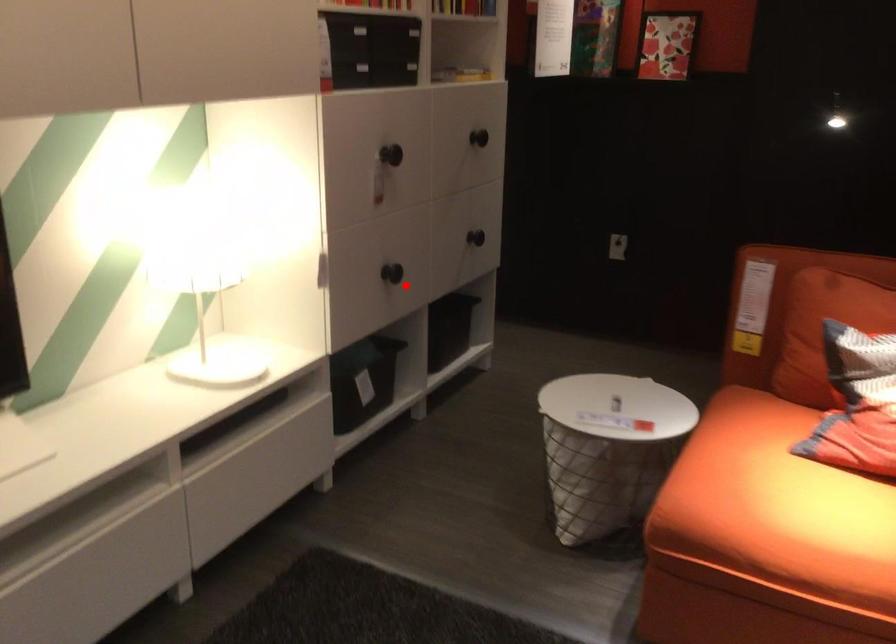
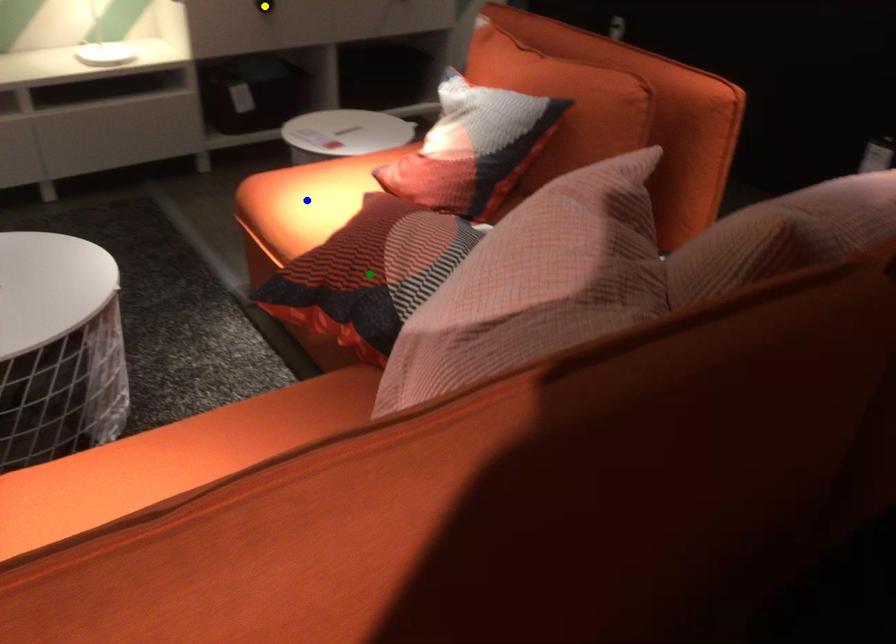
Question: I am providing you with two images of the same scene from different viewpoints. A red point is marked on the first image. You are given multiple points on the second image. In image 2, which mark is for the same physical point as the one in image 1?

Choices:
 (A) green point
 (B) blue point
 (C) yellow point

Answer: (C)